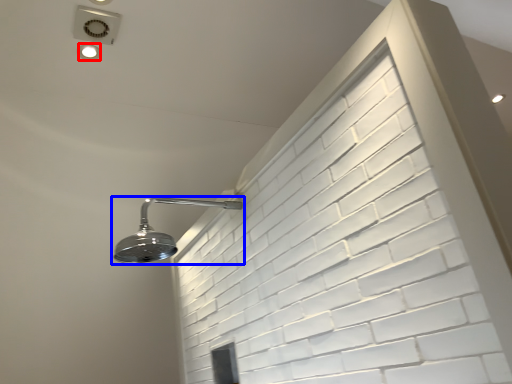
Question: Which point is closer to the camera, droplight (highlighted by a red box) or shower (highlighted by a blue box)?

Choices:
 (A) droplight
 (B) shower

Answer: (B)